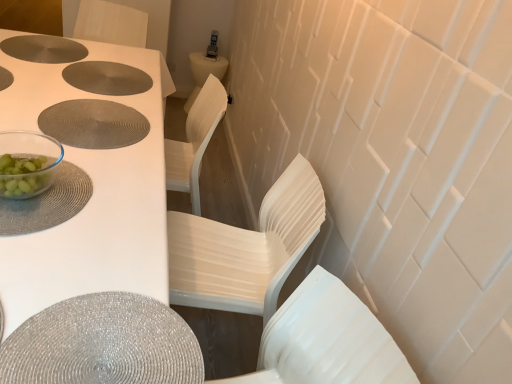
You are a GUI agent. You are given a task and a screenshot of the screen. Output one action in this format:
    pyautogui.click(x=<x>, y=<y>)
    Task: Click on the vacant area that lies between matte silver placemat at center, which ranks as the first hole in bottom-to-top order, and matte gray placemat at upper left, which is counted as the second hole, starting from the top
    The width and height of the screenshot is (512, 384).
    Given the screenshot: What is the action you would take?
    pyautogui.click(x=97, y=94)